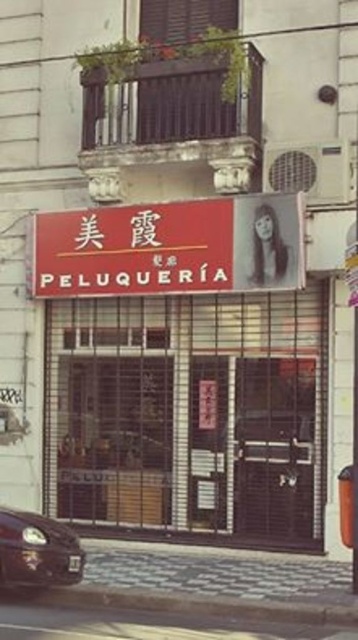
You are a delivery person trying to park your delivery van next to the shiny black car at lower left. The gray concrete curb at lower center is in the way. Can you fit your van between the curb and the car?

The gray concrete curb at lower center is larger than the shiny black car at lower left, so there might not be enough space for the delivery van to fit between them.

You are a delivery person approaching the PELUQUERIA storefront. You see the matte red sign at center and the shiny black car at lower left. Which object is closer to you as you approach the storefront?

The matte red sign at center is closer to you because it is further to the viewer than the shiny black car at lower left, meaning it appears nearer in the scene.